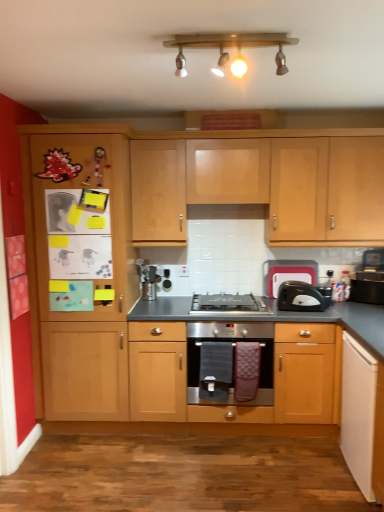
Where is `wooden cabinet at center, the 2th cabinetry from the top`? wooden cabinet at center, the 2th cabinetry from the top is located at coordinates point(273,368).

At what (x,y) coordinates should I click in order to perform the action: click on black plastic toaster at right, marked as the 2th appliance in a right-to-left arrangement. Please return your answer as a coordinate pair (x, y). This screenshot has width=384, height=512. Looking at the image, I should click on (287, 274).

This screenshot has width=384, height=512. What do you see at coordinates (303, 297) in the screenshot?
I see `black plastic toaster at right` at bounding box center [303, 297].

What is the approximate width of satin silver oven at center?

It is 20.18 inches.

How much space does black plastic toaster at right, the second appliance when ordered from back to front, occupy horizontally?

It is 4.78 inches.

I want to click on white matte cabinet at lower right, the 1th cabinetry when ordered from bottom to top, so click(358, 412).

This screenshot has height=512, width=384. What do you see at coordinates (358, 412) in the screenshot?
I see `white matte cabinet at lower right, the 1th cabinetry when ordered from bottom to top` at bounding box center [358, 412].

From the picture: What is the approximate height of light wood cabinet at upper center, marked as the third cabinetry in a bottom-to-top arrangement?

light wood cabinet at upper center, marked as the third cabinetry in a bottom-to-top arrangement, is 33.44 inches in height.

The height and width of the screenshot is (512, 384). Describe the element at coordinates (229, 46) in the screenshot. I see `wooden ceiling lights at upper center` at that location.

This screenshot has width=384, height=512. In order to click on wooden ceiling lights at upper center in this screenshot , I will do click(229, 46).

What are the coordinates of `wooden cabinet at center, marked as the 2th cabinetry in a bottom-to-top arrangement` in the screenshot? It's located at (273, 368).

Considering the sizes of black plastic toaster at right, marked as the first appliance in a left-to-right arrangement, and wooden ceiling lights at upper center in the image, is black plastic toaster at right, marked as the first appliance in a left-to-right arrangement, taller or shorter than wooden ceiling lights at upper center?

Clearly, black plastic toaster at right, marked as the first appliance in a left-to-right arrangement, is taller compared to wooden ceiling lights at upper center.

Between black plastic toaster at right, marked as the first appliance in a left-to-right arrangement, and wooden ceiling lights at upper center, which one has smaller size?

black plastic toaster at right, marked as the first appliance in a left-to-right arrangement, is smaller.

What's the angular difference between wooden cabinet at center, the 2th cabinetry from the top, and light wood cabinet at upper center, acting as the first cabinetry starting from the top,'s facing directions?

They differ by 0.248 degrees in their facing directions.

Based on the photo, can we say wooden cabinet at center, marked as the 2th cabinetry in a bottom-to-top arrangement, lies outside light wood cabinet at upper center, marked as the third cabinetry in a bottom-to-top arrangement?

Yes.

Considering their positions, is wooden cabinet at center, marked as the 2th cabinetry in a bottom-to-top arrangement, located in front of or behind light wood cabinet at upper center, marked as the third cabinetry in a bottom-to-top arrangement?

Clearly, wooden cabinet at center, marked as the 2th cabinetry in a bottom-to-top arrangement, is in front of light wood cabinet at upper center, marked as the third cabinetry in a bottom-to-top arrangement.

From a real-world perspective, between wooden cabinet at center, the 2th cabinetry from the top, and light wood cabinet at upper center, marked as the third cabinetry in a bottom-to-top arrangement, who is vertically lower?

wooden cabinet at center, the 2th cabinetry from the top.

Is wooden cabinet at left facing away from black plastic toaster at right, placed as the second appliance when sorted from left to right?

No, wooden cabinet at left's orientation is not away from black plastic toaster at right, placed as the second appliance when sorted from left to right.

Is wooden cabinet at left in front of black plastic toaster at right, which ranks as the 1th appliance in right-to-left order?

That is True.

Does wooden cabinet at center, marked as the 2th cabinetry in a bottom-to-top arrangement, appear on the left side of satin black gas stove at center?

In fact, wooden cabinet at center, marked as the 2th cabinetry in a bottom-to-top arrangement, is to the right of satin black gas stove at center.

How many degrees apart are the facing directions of wooden cabinet at center, marked as the 2th cabinetry in a bottom-to-top arrangement, and satin black gas stove at center?

0.248 degrees separate the facing orientations of wooden cabinet at center, marked as the 2th cabinetry in a bottom-to-top arrangement, and satin black gas stove at center.

Is wooden cabinet at center, the 2th cabinetry from the top, directly adjacent to satin black gas stove at center?

They are not placed beside each other.

Can you confirm if wooden cabinet at center, the 2th cabinetry from the top, is wider than satin black gas stove at center?

Yes.

From the image's perspective, is satin black gas stove at center located above or below black plastic toaster at right, marked as the 2th appliance in a right-to-left arrangement?

satin black gas stove at center is below black plastic toaster at right, marked as the 2th appliance in a right-to-left arrangement.

Between satin black gas stove at center and black plastic toaster at right, the second appliance viewed from the front, which one appears on the left side from the viewer's perspective?

Positioned to the left is satin black gas stove at center.

From a real-world perspective, is satin black gas stove at center over black plastic toaster at right, marked as the first appliance in a left-to-right arrangement?

No, from a real-world perspective, satin black gas stove at center is not above black plastic toaster at right, marked as the first appliance in a left-to-right arrangement.

Is the depth of satin black gas stove at center less than that of black plastic toaster at right, marked as the first appliance in a left-to-right arrangement?

Yes, the depth of satin black gas stove at center is less than that of black plastic toaster at right, marked as the first appliance in a left-to-right arrangement.

Based on the photo, which is correct: white matte cabinet at lower right, which appears as the third cabinetry when viewed from the top, is inside satin black gas stove at center, or outside of it?

The correct answer is: outside.

Is white matte cabinet at lower right, the 1th cabinetry when ordered from bottom to top, next to satin black gas stove at center and touching it?

white matte cabinet at lower right, the 1th cabinetry when ordered from bottom to top, and satin black gas stove at center are not in contact.

From the image's perspective, is white matte cabinet at lower right, the 1th cabinetry when ordered from bottom to top, under satin black gas stove at center?

Indeed, from the image's perspective, white matte cabinet at lower right, the 1th cabinetry when ordered from bottom to top, is shown beneath satin black gas stove at center.

From a real-world perspective, does white matte cabinet at lower right, the 1th cabinetry when ordered from bottom to top, sit lower than satin black gas stove at center?

Yes, from a real-world perspective, white matte cabinet at lower right, the 1th cabinetry when ordered from bottom to top, is below satin black gas stove at center.

Looking at this image, is wooden ceiling lights at upper center to the left or to the right of light wood cabinet at upper center, acting as the first cabinetry starting from the top, in the image?

wooden ceiling lights at upper center is to the left of light wood cabinet at upper center, acting as the first cabinetry starting from the top.

Is wooden ceiling lights at upper center aimed at light wood cabinet at upper center, marked as the third cabinetry in a bottom-to-top arrangement?

No, wooden ceiling lights at upper center does not turn towards light wood cabinet at upper center, marked as the third cabinetry in a bottom-to-top arrangement.

In the image, is wooden ceiling lights at upper center positioned in front of or behind light wood cabinet at upper center, marked as the third cabinetry in a bottom-to-top arrangement?

Visually, wooden ceiling lights at upper center is located in front of light wood cabinet at upper center, marked as the third cabinetry in a bottom-to-top arrangement.

Does point (173, 39) come farther from viewer compared to point (285, 155)?

No.

Identify the location of appliance that is the 1st one below the wooden ceiling lights at upper center (from a real-world perspective). (287, 274).

Where is `cabinetry above the wooden cabinet at center, marked as the 2th cabinetry in a bottom-to-top arrangement (from a real-world perspective)`? cabinetry above the wooden cabinet at center, marked as the 2th cabinetry in a bottom-to-top arrangement (from a real-world perspective) is located at coordinates [264, 185].

Considering their positions, is light wood cabinet at upper center, acting as the first cabinetry starting from the top, positioned closer to wooden ceiling lights at upper center than satin black gas stove at center?

light wood cabinet at upper center, acting as the first cabinetry starting from the top.

From the image, which object appears to be nearer to wooden cabinet at left, satin silver oven at center or satin black gas stove at center?

satin silver oven at center.

Considering their positions, is light wood cabinet at upper center, acting as the first cabinetry starting from the top, positioned further to satin silver oven at center than black plastic toaster at right, marked as the 2th appliance in a right-to-left arrangement?

light wood cabinet at upper center, acting as the first cabinetry starting from the top, is positioned further to the anchor satin silver oven at center.

When comparing their distances from satin black gas stove at center, does wooden cabinet at center, the 2th cabinetry from the top, or wooden ceiling lights at upper center seem closer?

The object closer to satin black gas stove at center is wooden cabinet at center, the 2th cabinetry from the top.

Which object lies further to the anchor point black plastic toaster at right, the second appliance when ordered from back to front, light wood cabinet at upper center, acting as the first cabinetry starting from the top, or satin black gas stove at center?

Among the two, light wood cabinet at upper center, acting as the first cabinetry starting from the top, is located further to black plastic toaster at right, the second appliance when ordered from back to front.

Considering their positions, is black plastic toaster at right positioned further to light wood cabinet at upper center, acting as the first cabinetry starting from the top, than wooden ceiling lights at upper center?

wooden ceiling lights at upper center.

From the image, which object appears to be nearer to wooden cabinet at center, the 2th cabinetry from the top, white matte cabinet at lower right, which appears as the third cabinetry when viewed from the top, or satin silver oven at center?

The object closer to wooden cabinet at center, the 2th cabinetry from the top, is satin silver oven at center.

When comparing their distances from wooden ceiling lights at upper center, does black plastic toaster at right, which ranks as the 1th appliance in right-to-left order, or satin black gas stove at center seem further?

black plastic toaster at right, which ranks as the 1th appliance in right-to-left order, is further to wooden ceiling lights at upper center.

The width and height of the screenshot is (384, 512). I want to click on oven between white matte cabinet at lower right, the 1th cabinetry when ordered from bottom to top, and black plastic toaster at right, the 1th appliance when ordered from back to front, from front to back, so click(228, 361).

Image resolution: width=384 pixels, height=512 pixels. I want to click on file cabinet between wooden ceiling lights at upper center and black plastic toaster at right, marked as the first appliance in a left-to-right arrangement, along the z-axis, so click(x=81, y=265).

This screenshot has width=384, height=512. Find the location of `oven between satin black gas stove at center and black plastic toaster at right, marked as the 2th appliance in a right-to-left arrangement, from left to right`. oven between satin black gas stove at center and black plastic toaster at right, marked as the 2th appliance in a right-to-left arrangement, from left to right is located at coordinates (228, 361).

At what (x,y) coordinates should I click in order to perform the action: click on gas stove between light wood cabinet at upper center, acting as the first cabinetry starting from the top, and white matte cabinet at lower right, which appears as the third cabinetry when viewed from the top, in the vertical direction. Please return your answer as a coordinate pair (x, y). The height and width of the screenshot is (512, 384). Looking at the image, I should click on 229,303.